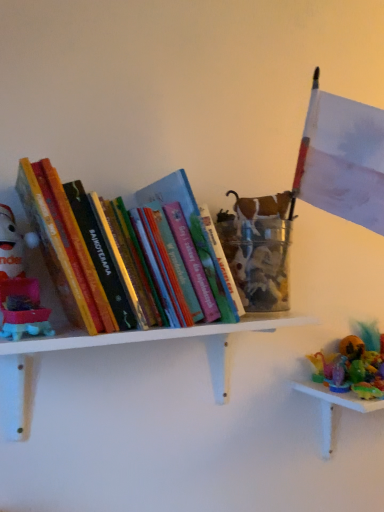
Question: Is white matte shelf at upper left next to plush red santa at left and touching it?

Choices:
 (A) yes
 (B) no

Answer: (B)

Question: Could you tell me if white matte shelf at upper left is facing plush red santa at left?

Choices:
 (A) yes
 (B) no

Answer: (B)

Question: From the image's perspective, is white matte shelf at upper left on top of plush red santa at left?

Choices:
 (A) yes
 (B) no

Answer: (B)

Question: Is white matte shelf at upper left positioned behind plush red santa at left?

Choices:
 (A) no
 (B) yes

Answer: (B)

Question: From a real-world perspective, is white matte shelf at upper left located beneath plush red santa at left?

Choices:
 (A) no
 (B) yes

Answer: (B)

Question: Can you confirm if white matte shelf at upper left is positioned to the left of plush red santa at left?

Choices:
 (A) no
 (B) yes

Answer: (A)

Question: Could hardcover books at left be considered to be inside white matte shelf at upper left?

Choices:
 (A) no
 (B) yes

Answer: (A)

Question: Is white matte shelf at upper left at the right side of hardcover books at left?

Choices:
 (A) no
 (B) yes

Answer: (B)

Question: From a real-world perspective, is white matte shelf at upper left located beneath hardcover books at left?

Choices:
 (A) yes
 (B) no

Answer: (A)

Question: From the image's perspective, is white matte shelf at upper left located beneath hardcover books at left?

Choices:
 (A) no
 (B) yes

Answer: (B)

Question: Considering the relative sizes of white matte shelf at upper left and hardcover books at left in the image provided, is white matte shelf at upper left smaller than hardcover books at left?

Choices:
 (A) no
 (B) yes

Answer: (B)

Question: Is white matte shelf at upper left in contact with hardcover books at left?

Choices:
 (A) no
 (B) yes

Answer: (A)

Question: Does plush red santa at left have a lesser width compared to white matte shelf at upper left?

Choices:
 (A) no
 (B) yes

Answer: (B)